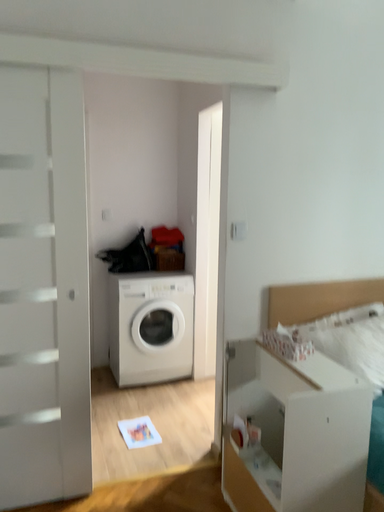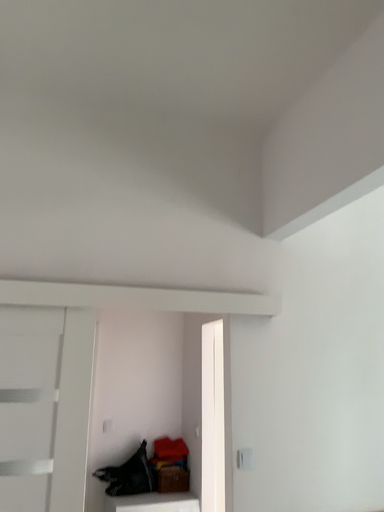
Question: Which way did the camera rotate in the video?

Choices:
 (A) rotated downward
 (B) rotated upward

Answer: (B)